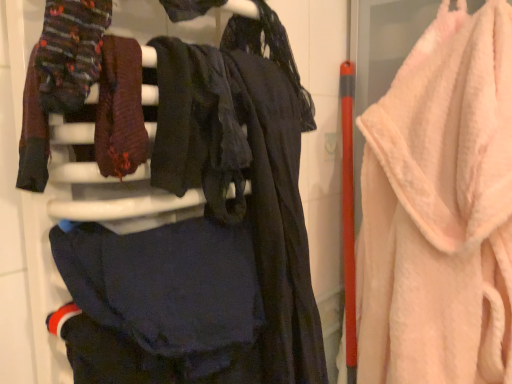
Question: Is knitted wool socks at upper left, arranged as the 1th clothing when viewed from the top, at the left side of pink fluffy towel at right?

Choices:
 (A) yes
 (B) no

Answer: (A)

Question: Is knitted wool socks at upper left, which is counted as the 2th clothing, starting from the bottom, smaller than pink fluffy towel at right?

Choices:
 (A) no
 (B) yes

Answer: (B)

Question: Considering the relative sizes of knitted wool socks at upper left, arranged as the 1th clothing when viewed from the top, and pink fluffy towel at right in the image provided, is knitted wool socks at upper left, arranged as the 1th clothing when viewed from the top, thinner than pink fluffy towel at right?

Choices:
 (A) no
 (B) yes

Answer: (B)

Question: Considering the relative sizes of knitted wool socks at upper left, arranged as the 1th clothing when viewed from the top, and pink fluffy towel at right in the image provided, is knitted wool socks at upper left, arranged as the 1th clothing when viewed from the top, taller than pink fluffy towel at right?

Choices:
 (A) yes
 (B) no

Answer: (B)

Question: Is knitted wool socks at upper left, which is counted as the 2th clothing, starting from the bottom, touching pink fluffy towel at right?

Choices:
 (A) no
 (B) yes

Answer: (A)

Question: Is point click(205, 329) positioned closer to the camera than point click(46, 158)?

Choices:
 (A) farther
 (B) closer

Answer: (A)

Question: From a real-world perspective, is dark matte fabric at center, the 2th clothing in the top-to-bottom sequence, above or below knitted wool socks at upper left, which is counted as the 2th clothing, starting from the bottom?

Choices:
 (A) below
 (B) above

Answer: (A)

Question: Considering their positions, is dark matte fabric at center, which ranks as the 1th clothing in bottom-to-top order, located in front of or behind knitted wool socks at upper left, which is counted as the 2th clothing, starting from the bottom?

Choices:
 (A) behind
 (B) front

Answer: (A)

Question: Is dark matte fabric at center, which ranks as the 1th clothing in bottom-to-top order, wider or thinner than knitted wool socks at upper left, arranged as the 1th clothing when viewed from the top?

Choices:
 (A) wide
 (B) thin

Answer: (A)

Question: Is pink fluffy towel at right in front of or behind velvet black dress at center in the image?

Choices:
 (A) behind
 (B) front

Answer: (A)

Question: From a real-world perspective, is pink fluffy towel at right physically located above or below velvet black dress at center?

Choices:
 (A) below
 (B) above

Answer: (A)

Question: Is point (421, 344) positioned closer to the camera than point (159, 127)?

Choices:
 (A) farther
 (B) closer

Answer: (A)

Question: From their relative heights in the image, would you say pink fluffy towel at right is taller or shorter than velvet black dress at center?

Choices:
 (A) tall
 (B) short

Answer: (A)

Question: In terms of width, does knitted wool socks at upper left, which is counted as the 2th clothing, starting from the bottom, look wider or thinner when compared to pink fluffy towel at right?

Choices:
 (A) wide
 (B) thin

Answer: (B)

Question: Considering the positions of knitted wool socks at upper left, arranged as the 1th clothing when viewed from the top, and pink fluffy towel at right in the image, is knitted wool socks at upper left, arranged as the 1th clothing when viewed from the top, taller or shorter than pink fluffy towel at right?

Choices:
 (A) tall
 (B) short

Answer: (B)